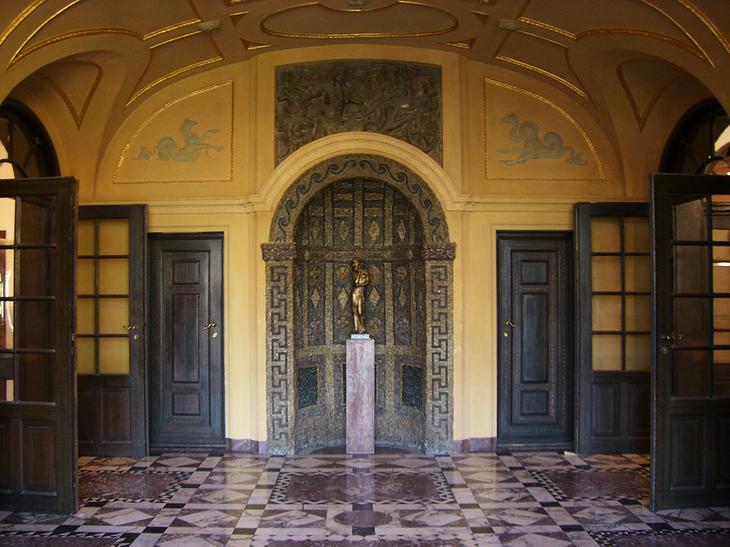
Where is `tiles`? tiles is located at coordinates (237, 488).